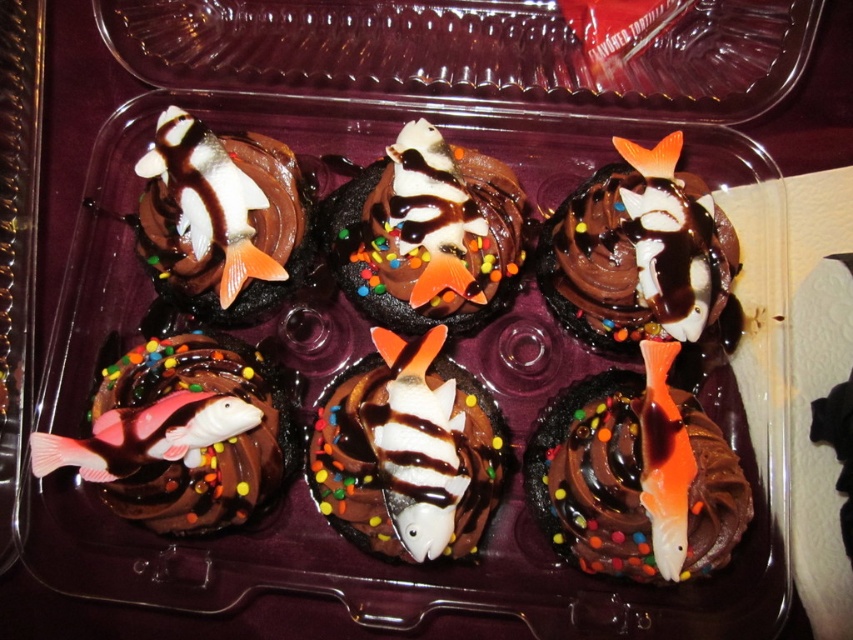
You are a customer at a bakery and see the clear plastic container with cupcakes. You want to choose the cupcake with the fish decoration that is placed higher up. Which one should you pick between the pink glossy fish at bottom left and the white glossy fish at center?

The pink glossy fish at bottom left is positioned over the white glossy fish at center, so the pink glossy fish at bottom left is higher up.